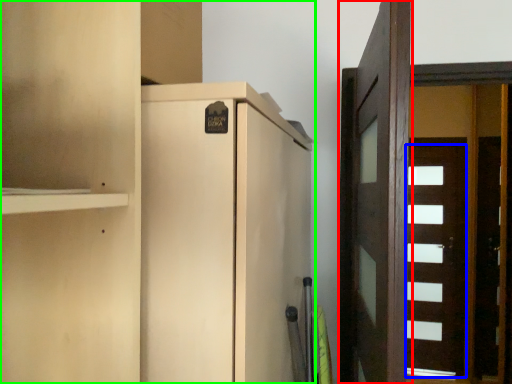
Question: Which is nearer to the door (highlighted by a red box)? door (highlighted by a blue box) or cupboard (highlighted by a green box).

Choices:
 (A) door
 (B) cupboard

Answer: (B)